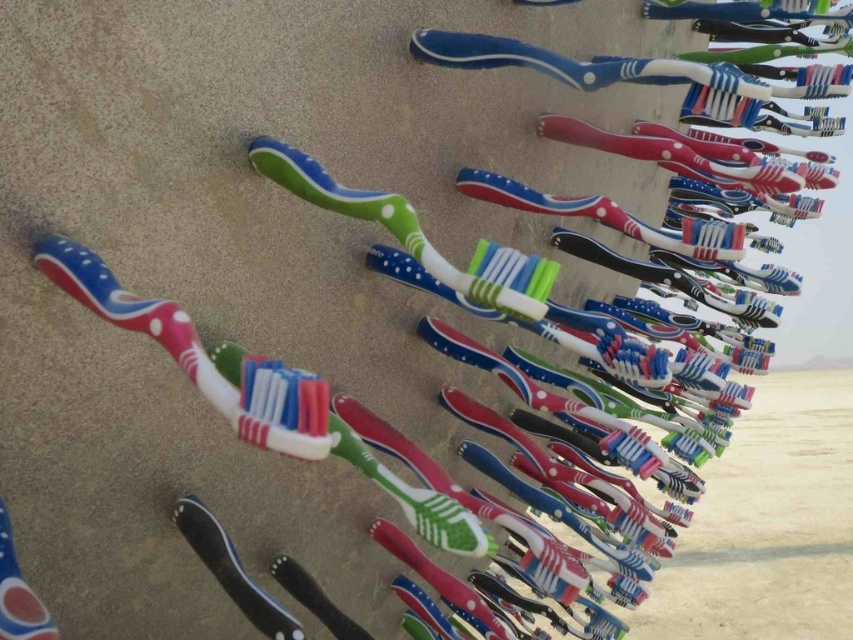
Could you measure the distance between blue glossy toothbrush at upper right and matte plastic toothpaste at lower left?

blue glossy toothbrush at upper right is 25.92 inches from matte plastic toothpaste at lower left.

Does blue glossy toothbrush at upper right have a smaller size compared to matte plastic toothpaste at lower left?

Actually, blue glossy toothbrush at upper right might be larger than matte plastic toothpaste at lower left.

Locate an element on the screen. The height and width of the screenshot is (640, 853). blue glossy toothbrush at upper right is located at coordinates (616, 67).

The height and width of the screenshot is (640, 853). Identify the location of blue glossy toothbrush at upper right. (616, 67).

Who is positioned more to the left, matte plastic toothbrush at center or blue glossy toothbrush at upper right?

matte plastic toothbrush at center is more to the left.

Between matte plastic toothbrush at center and blue glossy toothbrush at upper right, which one is positioned lower?

matte plastic toothbrush at center is below.

Where is `matte plastic toothbrush at center`? Image resolution: width=853 pixels, height=640 pixels. matte plastic toothbrush at center is located at coordinates (254, 392).

Who is more forward, (469, 540) or (10, 618)?

Point (10, 618) is more forward.

Can you confirm if matte plastic toothbrush at center is wider than matte plastic toothpaste at lower left?

Indeed, matte plastic toothbrush at center has a greater width compared to matte plastic toothpaste at lower left.

The width and height of the screenshot is (853, 640). What do you see at coordinates (254, 392) in the screenshot?
I see `matte plastic toothbrush at center` at bounding box center [254, 392].

Locate an element on the screen. matte plastic toothbrush at center is located at coordinates (254, 392).